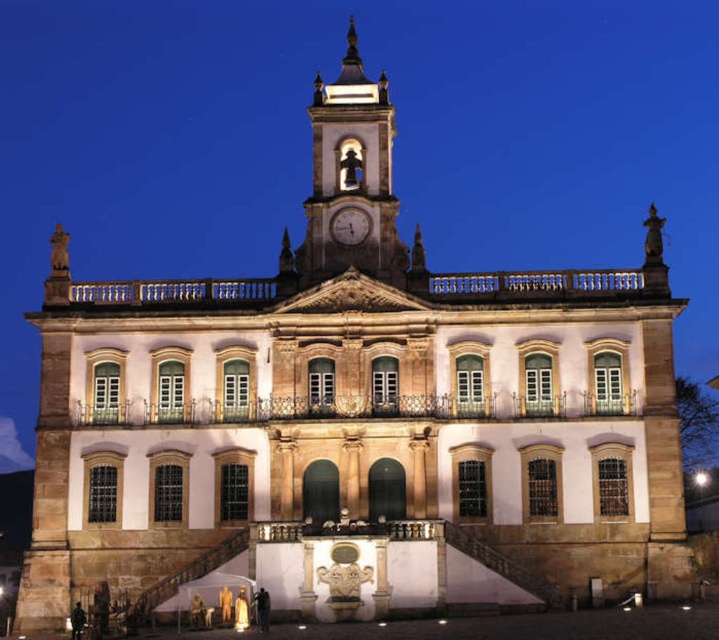
You are a maintenance worker who needs to reach both the polished stone clock tower at center and the metallic clock at center for inspection. The ladder you have can extend up to 15 feet. Can you safely reach both objects with the ladder you have?

The polished stone clock tower at center is 16.26 feet from the metallic clock at center. Since the ladder can only extend up to 15 feet, it is not long enough to safely reach both objects. You will need a longer ladder.

You are standing in front of the grand building at night. You notice the polished stone clock tower at center and the metallic clock at center. Which object is located higher up on the building?

The polished stone clock tower at center is positioned over the metallic clock at center, so it is located higher up on the building.